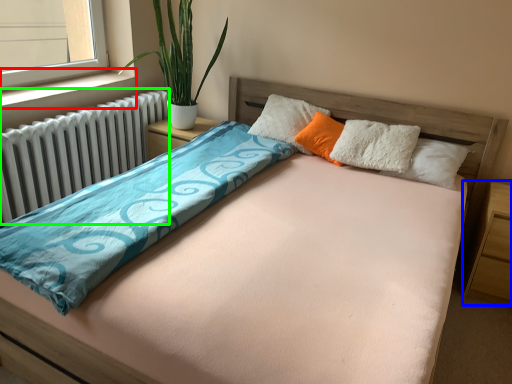
Question: Which object is the farthest from window sill (highlighted by a red box)? Choose among these: nightstand (highlighted by a blue box) or radiator (highlighted by a green box).

Choices:
 (A) nightstand
 (B) radiator

Answer: (A)